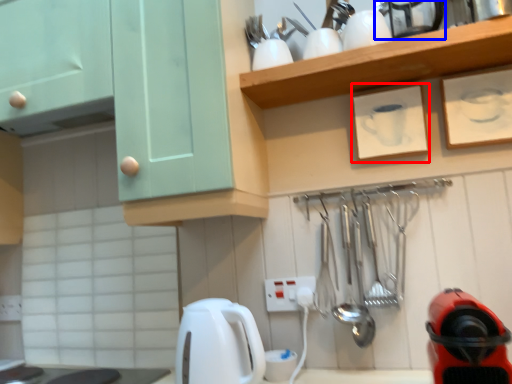
Question: Which point is closer to the camera, picture frame (highlighted by a red box) or appliance (highlighted by a blue box)?

Choices:
 (A) picture frame
 (B) appliance

Answer: (B)